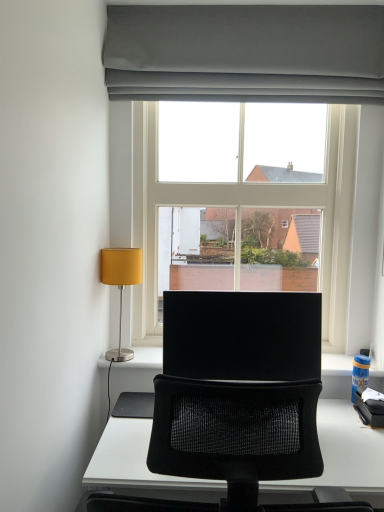
Identify the location of matte gray curtain at upper center. The width and height of the screenshot is (384, 512). (245, 53).

The image size is (384, 512). What do you see at coordinates (242, 336) in the screenshot?
I see `black matte computer monitor at center` at bounding box center [242, 336].

Identify the location of matte gray curtain at upper center. (245, 53).

Is clear glass window at center looking in the opposite direction of matte yellow fabric lampshade at left?

No, clear glass window at center's orientation is not away from matte yellow fabric lampshade at left.

Who is bigger, clear glass window at center or matte yellow fabric lampshade at left?

clear glass window at center.

Which is correct: clear glass window at center is inside matte yellow fabric lampshade at left, or outside of it?

clear glass window at center is outside matte yellow fabric lampshade at left.

Looking at this image, is matte gray curtain at upper center outside of matte yellow fabric lampshade at left?

matte gray curtain at upper center is positioned outside matte yellow fabric lampshade at left.

Considering the sizes of objects matte gray curtain at upper center and matte yellow fabric lampshade at left in the image provided, who is thinner, matte gray curtain at upper center or matte yellow fabric lampshade at left?

matte gray curtain at upper center is thinner.

Is point (292, 54) closer to viewer compared to point (141, 260)?

That is True.

How far apart are matte gray curtain at upper center and matte yellow fabric lampshade at left?

matte gray curtain at upper center and matte yellow fabric lampshade at left are 84.74 centimeters apart.

Considering the sizes of objects matte gray curtain at upper center and black matte computer monitor at center in the image provided, who is taller, matte gray curtain at upper center or black matte computer monitor at center?

With more height is black matte computer monitor at center.

Is matte gray curtain at upper center looking in the opposite direction of black matte computer monitor at center?

matte gray curtain at upper center does not have its back to black matte computer monitor at center.

From the picture: Which object is further away from the camera taking this photo, matte gray curtain at upper center or black matte computer monitor at center?

matte gray curtain at upper center.

Between clear glass window at center and black matte computer monitor at center, which one has smaller width?

Thinner between the two is black matte computer monitor at center.

Is clear glass window at center oriented away from black matte computer monitor at center?

No, clear glass window at center is not facing away from black matte computer monitor at center.

Are clear glass window at center and black matte computer monitor at center making contact?

No, clear glass window at center is not in contact with black matte computer monitor at center.

Can you confirm if black matte computer monitor at center is shorter than clear glass window at center?

Correct, black matte computer monitor at center is not as tall as clear glass window at center.

Considering the positions of objects black matte computer monitor at center and clear glass window at center in the image provided, who is behind, black matte computer monitor at center or clear glass window at center?

clear glass window at center is more distant.

Which is nearer, (177, 361) or (343, 224)?

The point (177, 361) is closer to the camera.

Consider the image. Measure the distance from black matte computer monitor at center to clear glass window at center.

black matte computer monitor at center and clear glass window at center are 25.27 inches apart from each other.

Is the depth of clear glass window at center less than that of matte gray curtain at upper center?

No, it is behind matte gray curtain at upper center.

Is clear glass window at center surrounding matte gray curtain at upper center?

No, matte gray curtain at upper center is not inside clear glass window at center.

Is clear glass window at center not near matte gray curtain at upper center?

That's not correct — clear glass window at center is a little close to matte gray curtain at upper center.

Is clear glass window at center oriented towards matte gray curtain at upper center?

No, clear glass window at center does not turn towards matte gray curtain at upper center.

Looking at this image, is matte yellow fabric lampshade at left directly adjacent to black matte computer monitor at center?

matte yellow fabric lampshade at left and black matte computer monitor at center are clearly separated.

In the image, is matte yellow fabric lampshade at left positioned in front of or behind black matte computer monitor at center?

Visually, matte yellow fabric lampshade at left is located behind black matte computer monitor at center.

From the image's perspective, is matte yellow fabric lampshade at left located above or below black matte computer monitor at center?

matte yellow fabric lampshade at left is situated higher than black matte computer monitor at center in the image.

Where is `lamp that appears on the left of clear glass window at center`? The image size is (384, 512). lamp that appears on the left of clear glass window at center is located at coordinates (121, 285).

Locate an element on the screen. curtain above the matte yellow fabric lampshade at left (from the image's perspective) is located at coordinates (245, 53).

Which object lies nearer to the anchor point matte gray curtain at upper center, clear glass window at center or black matte computer monitor at center?

clear glass window at center is positioned closer to the anchor matte gray curtain at upper center.

Looking at the image, which one is located closer to clear glass window at center, matte gray curtain at upper center or black matte computer monitor at center?

matte gray curtain at upper center lies closer to clear glass window at center than the other object.

Considering their positions, is black matte computer monitor at center positioned closer to clear glass window at center than matte gray curtain at upper center?

The object closer to clear glass window at center is matte gray curtain at upper center.

Looking at the image, which one is located closer to matte yellow fabric lampshade at left, black matte computer monitor at center or clear glass window at center?

black matte computer monitor at center lies closer to matte yellow fabric lampshade at left than the other object.

When comparing their distances from matte gray curtain at upper center, does black matte computer monitor at center or matte yellow fabric lampshade at left seem further?

Among the two, black matte computer monitor at center is located further to matte gray curtain at upper center.

Considering their positions, is matte gray curtain at upper center positioned closer to matte yellow fabric lampshade at left than black matte computer monitor at center?

black matte computer monitor at center is closer to matte yellow fabric lampshade at left.

Considering their positions, is clear glass window at center positioned closer to matte gray curtain at upper center than matte yellow fabric lampshade at left?

clear glass window at center lies closer to matte gray curtain at upper center than the other object.

From the image, which object appears to be nearer to black matte computer monitor at center, matte yellow fabric lampshade at left or matte gray curtain at upper center?

The object closer to black matte computer monitor at center is matte yellow fabric lampshade at left.

The image size is (384, 512). Identify the location of window between matte gray curtain at upper center and black matte computer monitor at center in the up-down direction. (245, 53).

Where is `window between matte gray curtain at upper center and matte yellow fabric lampshade at left in the up-down direction`? This screenshot has width=384, height=512. window between matte gray curtain at upper center and matte yellow fabric lampshade at left in the up-down direction is located at coordinates (245, 53).

Where is `lamp between matte gray curtain at upper center and black matte computer monitor at center from top to bottom`? This screenshot has width=384, height=512. lamp between matte gray curtain at upper center and black matte computer monitor at center from top to bottom is located at coordinates (121, 285).

This screenshot has height=512, width=384. I want to click on computer monitor between matte yellow fabric lampshade at left and clear glass window at center in the horizontal direction, so click(242, 336).